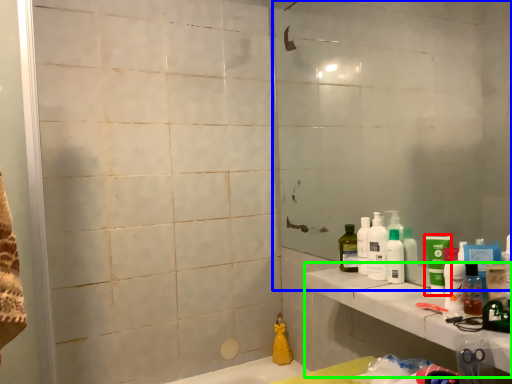
Question: Which is farther away from mouthwash (highlighted by a red box)? mirror (highlighted by a blue box) or counter top (highlighted by a green box)?

Choices:
 (A) mirror
 (B) counter top

Answer: (A)